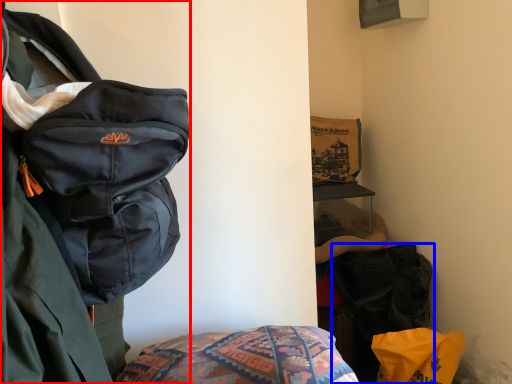
Question: Which of the following is the closest to the observer, backpack (highlighted by a red box) or luggage and bags (highlighted by a blue box)?

Choices:
 (A) backpack
 (B) luggage and bags

Answer: (A)